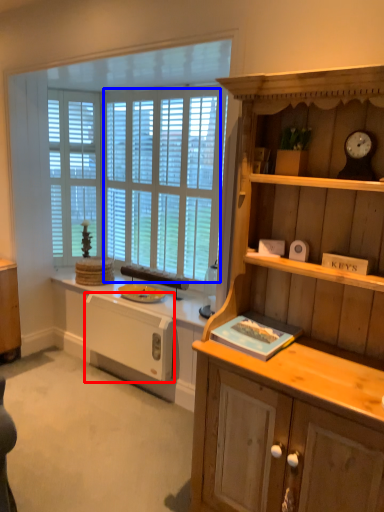
Question: Which object is closer to the camera taking this photo, appliance (highlighted by a red box) or window screen (highlighted by a blue box)?

Choices:
 (A) appliance
 (B) window screen

Answer: (A)